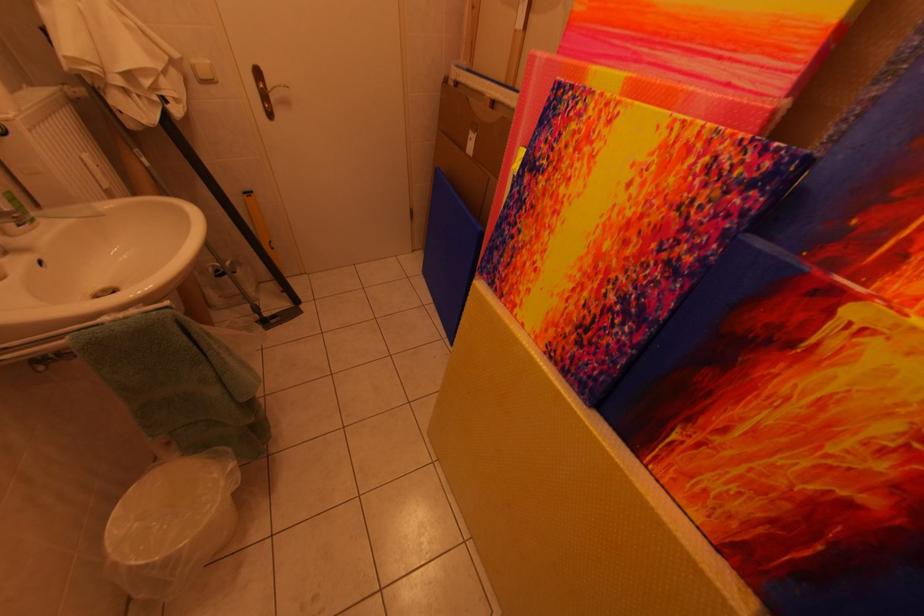
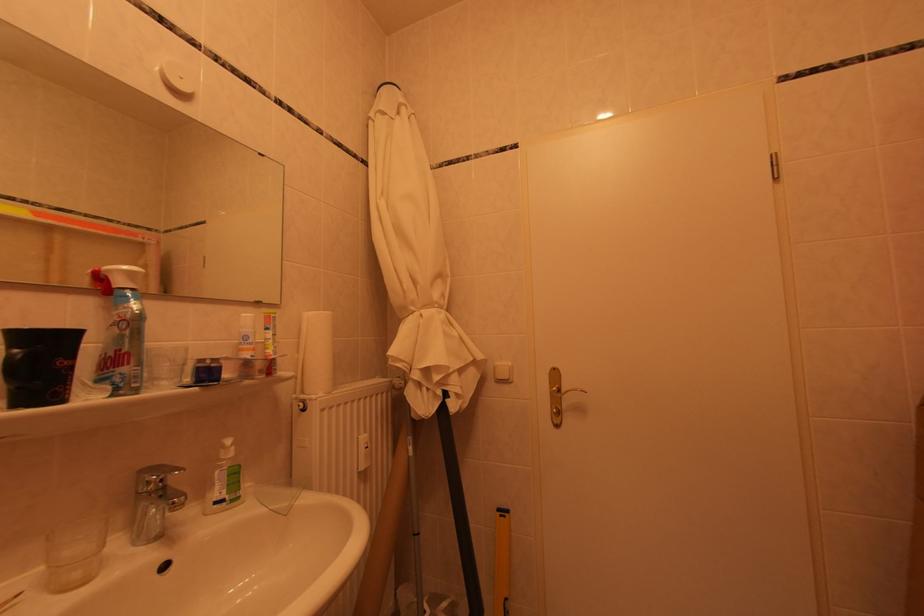
Where in the second image is the point corresponding to point (257, 200) from the first image?

(509, 519)